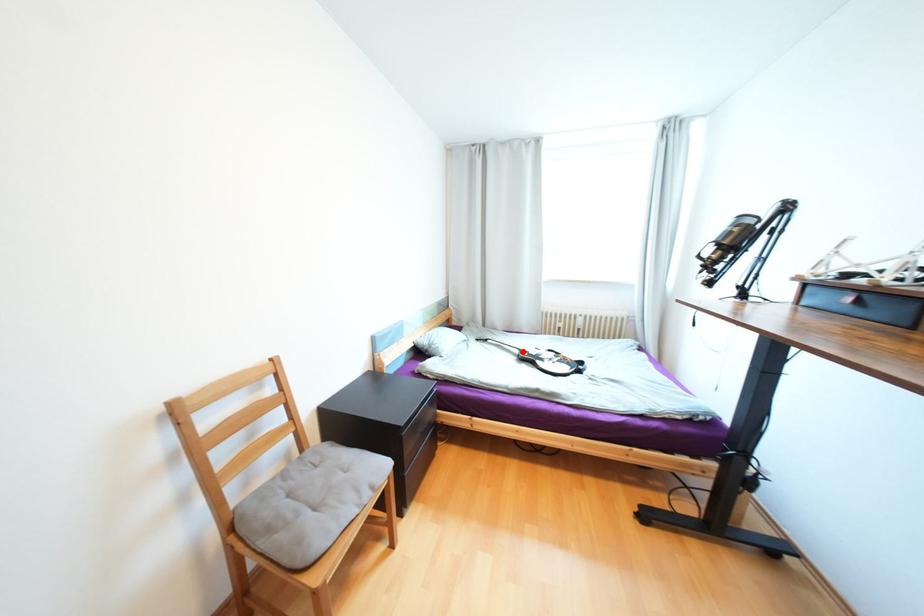
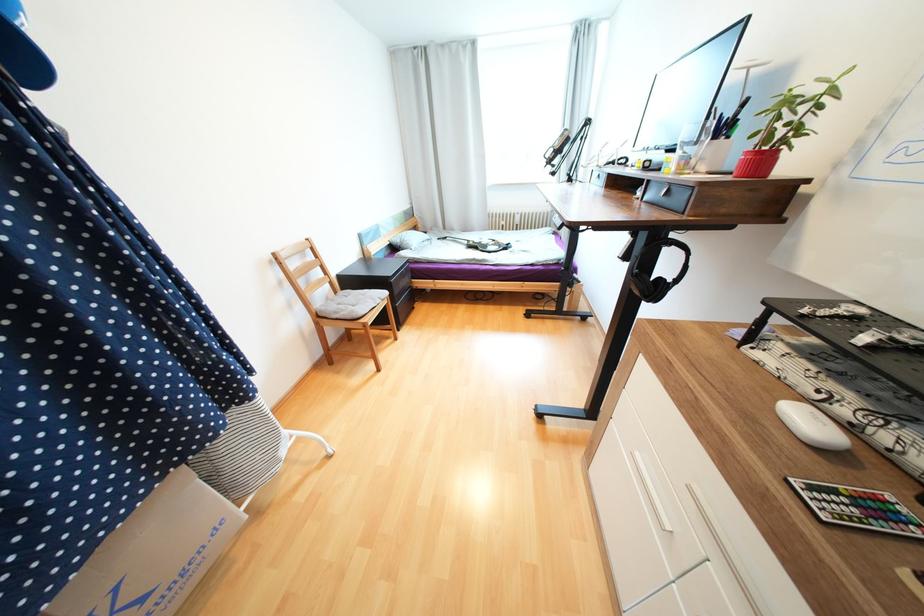
Find the pixel in the second image that matches the highlighted location in the first image.

(471, 243)